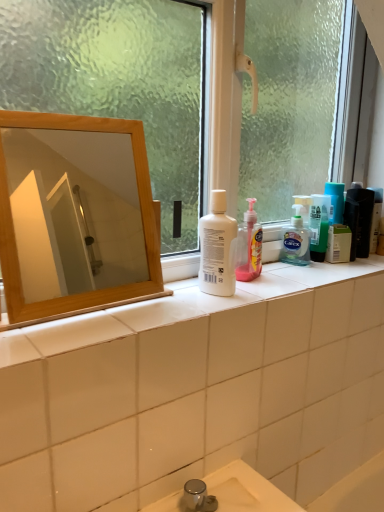
Question: Is translucent plastic bottle at right, the 2th toiletry positioned from the left, facing towards white plastic bottle at center?

Choices:
 (A) yes
 (B) no

Answer: (B)

Question: Considering the relative sizes of translucent plastic bottle at right, the first toiletry positioned from the right, and white plastic bottle at center in the image provided, is translucent plastic bottle at right, the first toiletry positioned from the right, thinner than white plastic bottle at center?

Choices:
 (A) yes
 (B) no

Answer: (A)

Question: From the image's perspective, is translucent plastic bottle at right, the 2th toiletry positioned from the left, on white plastic bottle at center?

Choices:
 (A) no
 (B) yes

Answer: (B)

Question: Is translucent plastic bottle at right, the 2th toiletry positioned from the left, looking in the opposite direction of white plastic bottle at center?

Choices:
 (A) yes
 (B) no

Answer: (B)

Question: From the image's perspective, is translucent plastic bottle at right, the 2th toiletry positioned from the left, located beneath white plastic bottle at center?

Choices:
 (A) no
 (B) yes

Answer: (A)

Question: Considering the positions of point (360, 202) and point (370, 188), is point (360, 202) closer or farther from the camera than point (370, 188)?

Choices:
 (A) closer
 (B) farther

Answer: (A)

Question: Looking at their shapes, would you say matte black hair care product at right, acting as the 1th toiletry starting from the left, is wider or thinner than translucent plastic bottle at right, the first toiletry positioned from the right?

Choices:
 (A) wide
 (B) thin

Answer: (A)

Question: Visually, is matte black hair care product at right, acting as the 1th toiletry starting from the left, positioned to the left or to the right of translucent plastic bottle at right, the 2th toiletry positioned from the left?

Choices:
 (A) right
 (B) left

Answer: (B)

Question: Considering the positions of matte black hair care product at right, acting as the 1th toiletry starting from the left, and translucent plastic bottle at right, the first toiletry positioned from the right, in the image, is matte black hair care product at right, acting as the 1th toiletry starting from the left, bigger or smaller than translucent plastic bottle at right, the first toiletry positioned from the right,?

Choices:
 (A) big
 (B) small

Answer: (A)

Question: Do you think translucent plastic bottle at right, the first toiletry positioned from the right, is within transparent glass window at center, or outside of it?

Choices:
 (A) inside
 (B) outside

Answer: (B)

Question: From the image's perspective, is translucent plastic bottle at right, the first toiletry positioned from the right, positioned above or below transparent glass window at center?

Choices:
 (A) below
 (B) above

Answer: (A)

Question: In terms of height, does translucent plastic bottle at right, the first toiletry positioned from the right, look taller or shorter compared to transparent glass window at center?

Choices:
 (A) short
 (B) tall

Answer: (A)

Question: From a real-world perspective, is translucent plastic bottle at right, the first toiletry positioned from the right, positioned above or below transparent glass window at center?

Choices:
 (A) above
 (B) below

Answer: (B)

Question: Is point (344, 200) positioned closer to the camera than point (86, 134)?

Choices:
 (A) closer
 (B) farther

Answer: (A)

Question: From a real-world perspective, is matte black hair care product at right, acting as the 1th toiletry starting from the left, physically located above or below wooden mirror at upper left?

Choices:
 (A) below
 (B) above

Answer: (A)